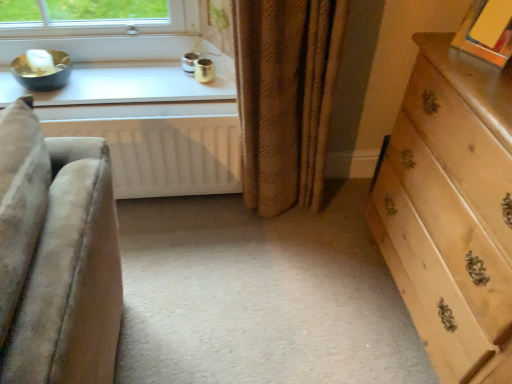
I want to click on vacant space to the right of white matte radiator at lower center, so click(x=244, y=241).